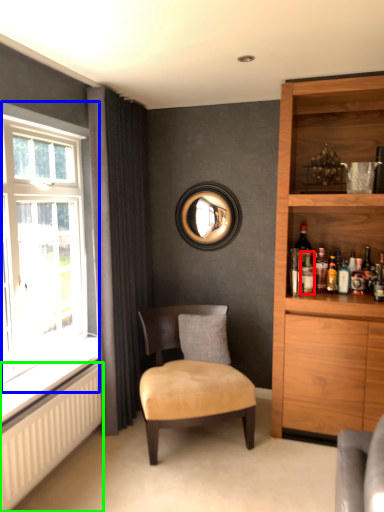
Question: Which object is the farthest from bottle (highlighted by a red box)? Choose among these: window (highlighted by a blue box) or radiator (highlighted by a green box).

Choices:
 (A) window
 (B) radiator

Answer: (B)